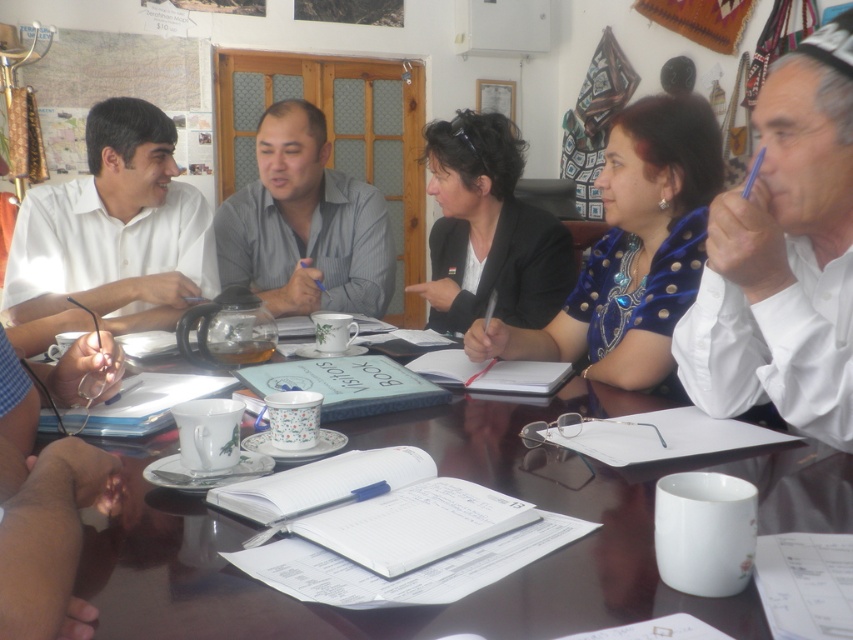
Does blue embroidered blouse at center appear over white shirt at left?

No.

Can you confirm if blue embroidered blouse at center is smaller than white shirt at left?

Correct, blue embroidered blouse at center occupies less space than white shirt at left.

Does point (634, 154) come in front of point (115, 243)?

Yes, it is in front of point (115, 243).

Where is `blue embroidered blouse at center`? blue embroidered blouse at center is located at coordinates (631, 250).

Can you confirm if glossy wooden table at center is positioned above blue embroidered blouse at center?

Incorrect, glossy wooden table at center is not positioned above blue embroidered blouse at center.

Between glossy wooden table at center and blue embroidered blouse at center, which one is positioned lower?

Positioned lower is glossy wooden table at center.

Who is more forward, (x=665, y=460) or (x=672, y=120)?

Point (x=665, y=460) is more forward.

The width and height of the screenshot is (853, 640). I want to click on glossy wooden table at center, so click(465, 477).

Does point (691, 600) lie in front of point (813, 378)?

Yes, point (691, 600) is in front of point (813, 378).

The image size is (853, 640). What do you see at coordinates (465, 477) in the screenshot?
I see `glossy wooden table at center` at bounding box center [465, 477].

Is point (287, 632) closer to camera compared to point (825, 435)?

Yes, it is.

This screenshot has height=640, width=853. I want to click on glossy wooden table at center, so click(x=465, y=477).